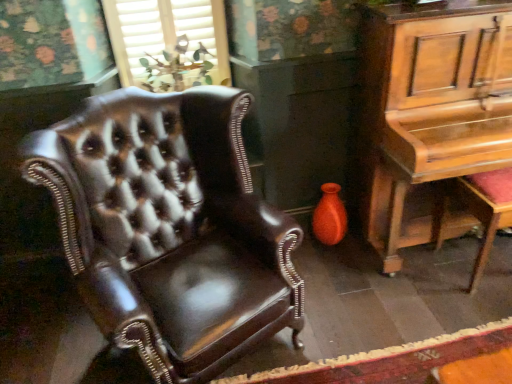
You are a GUI agent. You are given a task and a screenshot of the screen. Output one action in this format:
    pyautogui.click(x=<x>, y=<y>)
    Task: Click on the vacant area that lies between red cushioned stool at right and wooden piano at right
    This screenshot has width=512, height=384.
    Given the screenshot: What is the action you would take?
    pyautogui.click(x=440, y=301)